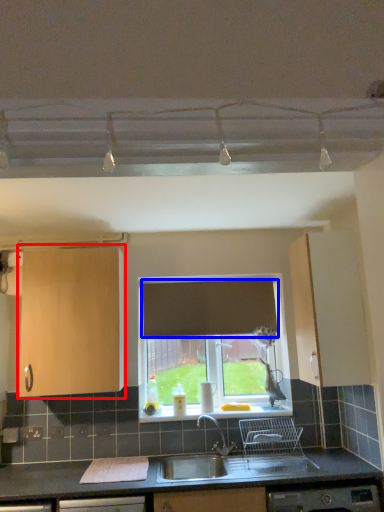
Question: Which of the following is the closest to the observer, cabinetry (highlighted by a red box) or curtain (highlighted by a blue box)?

Choices:
 (A) cabinetry
 (B) curtain

Answer: (A)